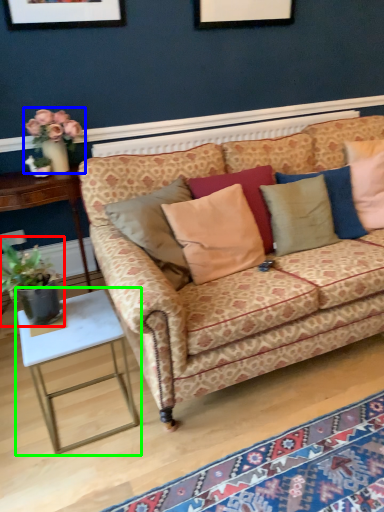
Question: Which object is the farthest from houseplant (highlighted by a red box)? Choose among these: floral arrangement (highlighted by a blue box) or table (highlighted by a green box).

Choices:
 (A) floral arrangement
 (B) table

Answer: (A)